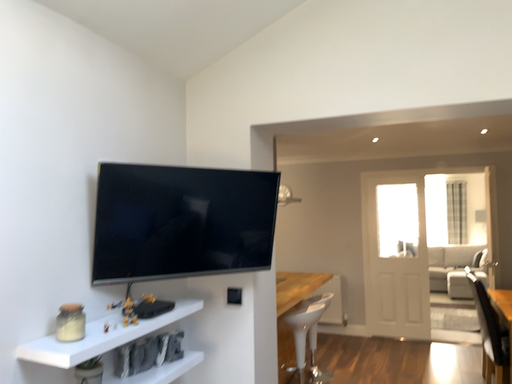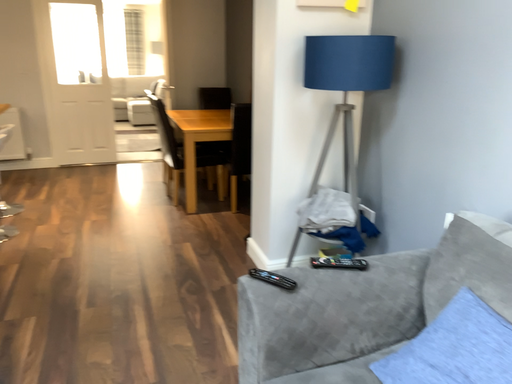
Question: How did the camera likely rotate when shooting the video?

Choices:
 (A) rotated left
 (B) rotated right

Answer: (B)